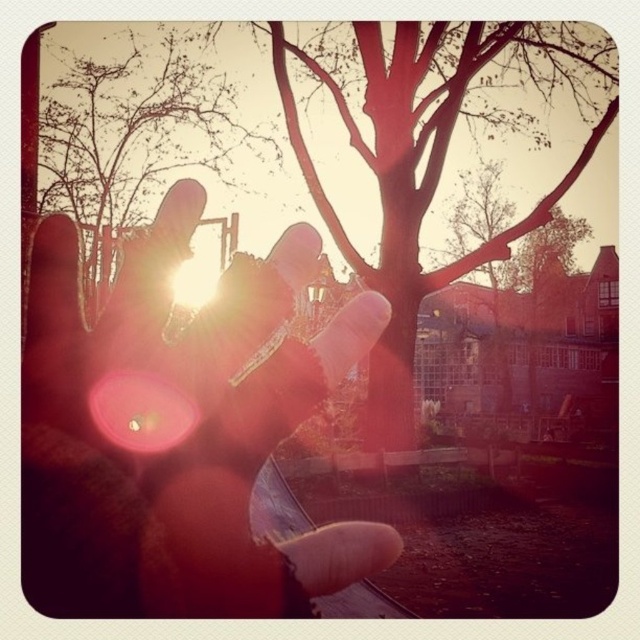
You are a photographer trying to capture the sunset through your fingers. You notice the translucent skin at center and the brown matte tree at upper center in your frame. Which object appears larger in the photo?

The brown matte tree at upper center appears larger because the translucent skin at center is smaller than it.

Looking at this image, you are a photographer trying to capture the sunset through your fingers. You notice the translucent skin at center and the smooth bark tree at center in your viewfinder. Which object will appear closer to you in the photo?

The translucent skin at center will appear closer to you in the photo because it is positioned in front of the smooth bark tree at center.

You are a photographer trying to capture the sunset through your fingers. You notice the translucent skin at center and the brown matte tree at upper center in your viewfinder. Which object appears narrower in your current composition?

The translucent skin at center appears narrower than the brown matte tree at upper center because it has a lesser width compared to the tree.